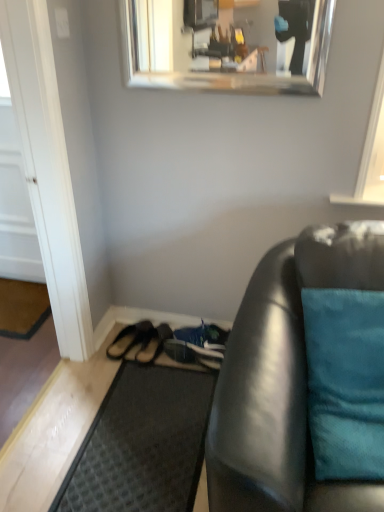
Question: In terms of height, does teal fabric pillow at right look taller or shorter compared to brown suede sandals at lower center, arranged as the second footwear when viewed from the left?

Choices:
 (A) tall
 (B) short

Answer: (A)

Question: From a real-world perspective, is teal fabric pillow at right above or below brown suede sandals at lower center, acting as the 1th footwear starting from the right?

Choices:
 (A) above
 (B) below

Answer: (A)

Question: Which object is positioned farthest from the teal fabric pillow at right?

Choices:
 (A) white wood door at lower left
 (B) brown leather sandals at lower left, acting as the 1th footwear starting from the left
 (C) brown suede sandals at lower center, arranged as the second footwear when viewed from the left
 (D) dark gray textured mat at left, the 1th doormat in the left-to-right sequence
 (E) silver metallic mirror at upper center

Answer: (E)

Question: Based on their relative distances, which object is nearer to the silver metallic mirror at upper center?

Choices:
 (A) black rubber doormat at lower center, which is the second doormat from top to bottom
 (B) brown leather sandals at lower left, which is counted as the 2th footwear, starting from the right
 (C) white glossy door at left
 (D) teal fabric pillow at right
 (E) white wood door at lower left

Answer: (C)